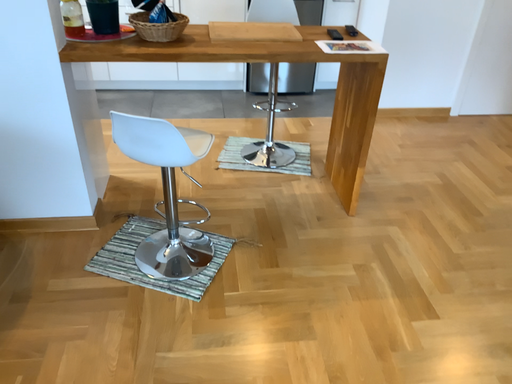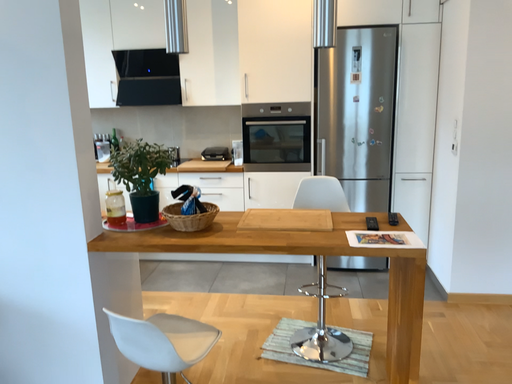
Question: Which way did the camera rotate in the video?

Choices:
 (A) rotated left
 (B) rotated right

Answer: (A)